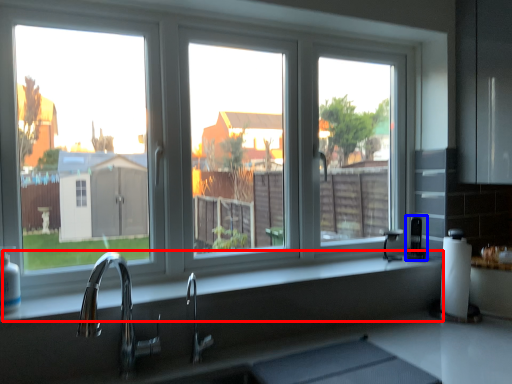
Question: Which of the following is the farthest to the observer, counter top (highlighted by a red box) or appliance (highlighted by a blue box)?

Choices:
 (A) counter top
 (B) appliance

Answer: (B)